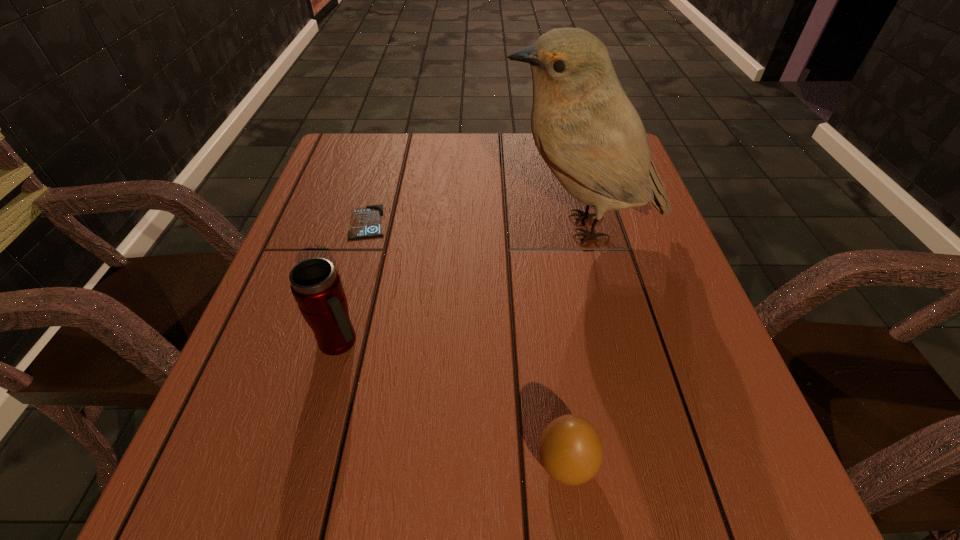
Where is `empty location between the nearest object and the second tallest object`? The width and height of the screenshot is (960, 540). empty location between the nearest object and the second tallest object is located at coordinates (452, 403).

Where is `vacant area that lies between the thermos bottle and the tallest object`? The width and height of the screenshot is (960, 540). vacant area that lies between the thermos bottle and the tallest object is located at coordinates (461, 284).

Image resolution: width=960 pixels, height=540 pixels. Identify the location of vacant space that's between the parakeet and the third tallest object. (574, 346).

Point out which object is positioned as the third nearest to the identity card. Please provide its 2D coordinates. Your answer should be formatted as a tuple, i.e. [(x, y)], where the tuple contains the x and y coordinates of a point satisfying the conditions above.

[(571, 451)]

What are the coordinates of `object that can be found as the closest to the parakeet` in the screenshot? It's located at (366, 222).

At what (x,y) coordinates should I click in order to perform the action: click on free space that satisfies the following two spatial constraints: 1. on the front side of the nearest object; 2. on the left side of the shortest object. Please return your answer as a coordinate pair (x, y). This screenshot has height=540, width=960. Looking at the image, I should click on (300, 465).

You are a GUI agent. You are given a task and a screenshot of the screen. Output one action in this format:
    pyautogui.click(x=<x>, y=<y>)
    Task: Click on the free space that satisfies the following two spatial constraints: 1. on the side with the handle of the second tallest object; 2. on the left side of the nearest object
    This screenshot has height=540, width=960.
    Given the screenshot: What is the action you would take?
    pyautogui.click(x=306, y=465)

Image resolution: width=960 pixels, height=540 pixels. I want to click on vacant point that satisfies the following two spatial constraints: 1. on the face of the parakeet; 2. on the front side of the nearest object, so click(642, 465).

You are a GUI agent. You are given a task and a screenshot of the screen. Output one action in this format:
    pyautogui.click(x=<x>, y=<y>)
    Task: Click on the free spot that satisfies the following two spatial constraints: 1. on the front side of the identity card; 2. on the left side of the second shortest object
    
    Given the screenshot: What is the action you would take?
    pyautogui.click(x=300, y=465)